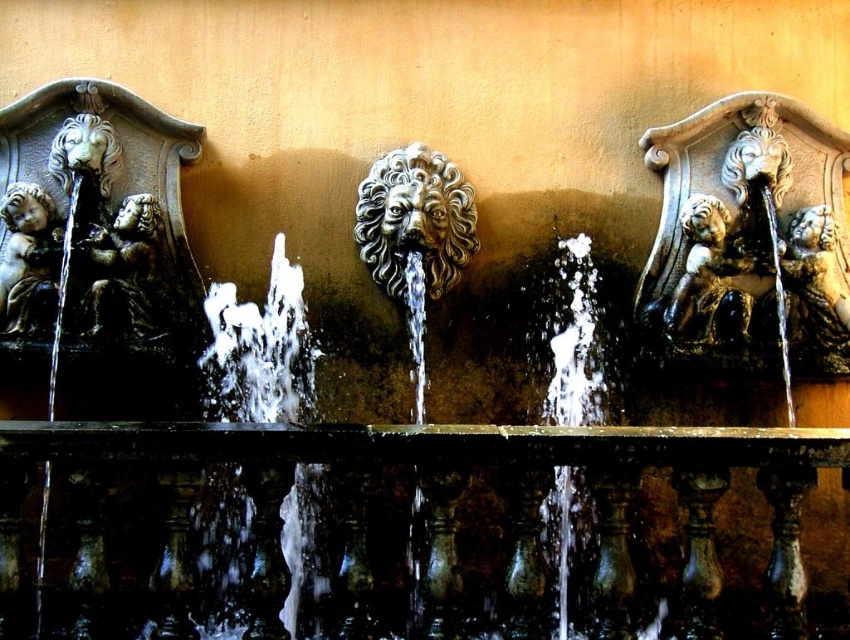
You are standing in front of the fountain and want to place a small decoration exactly at the point marked by coordinates point (707, 280). What object is located there?

The bronze cherub at center is located at point (707, 280).

From the picture: You are standing in front of the fountain and want to take a photo of the bronze statue at left and the bronze cherub at left. Which one is positioned farther away from you?

The bronze cherub at left is behind the bronze statue at left, so it is farther away from you.